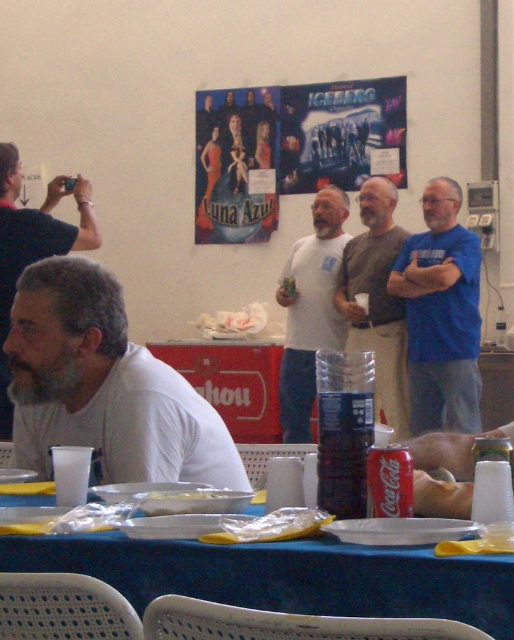
Question: Which point appears closest to the camera in this image?

Choices:
 (A) (71, 321)
 (B) (322, 556)
 (C) (6, 248)
 (D) (211, 486)

Answer: (B)

Question: Which is nearer to the white matte t-shirt at center?

Choices:
 (A) gray fabric shirt at center
 (B) white matte shirt at left
 (C) blue fabric table at lower center

Answer: (A)

Question: Among these points, which one is nearest to the camera?

Choices:
 (A) (45, 568)
 (B) (376, 188)
 (C) (271, 528)

Answer: (C)

Question: Can you confirm if blue fabric table at lower center is bigger than gray beard at left?

Choices:
 (A) no
 (B) yes

Answer: (A)

Question: Is gray fabric shirt at center bigger than yellow plastic bag at table?

Choices:
 (A) no
 (B) yes

Answer: (B)

Question: Is blue t-shirt at center smaller than gray beard at left?

Choices:
 (A) yes
 (B) no

Answer: (B)